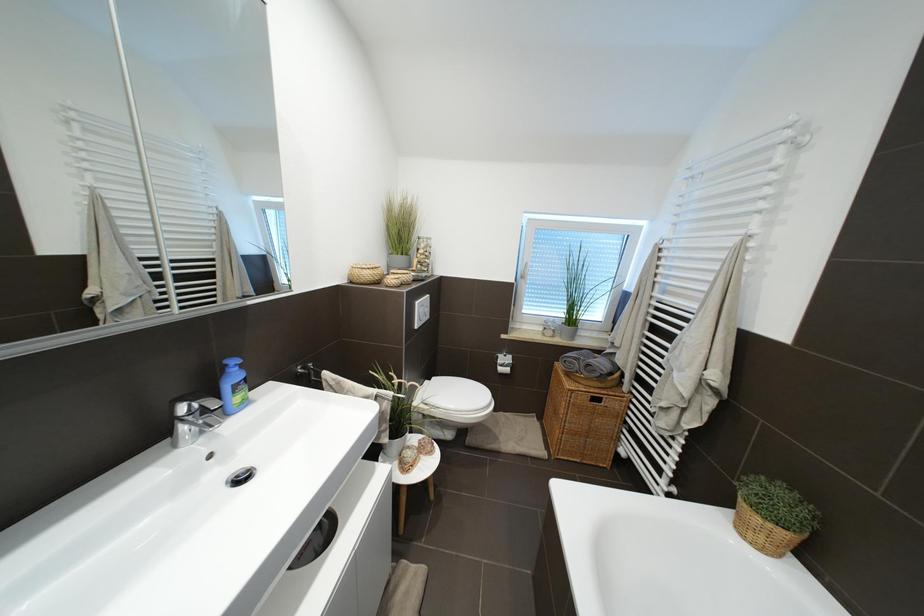
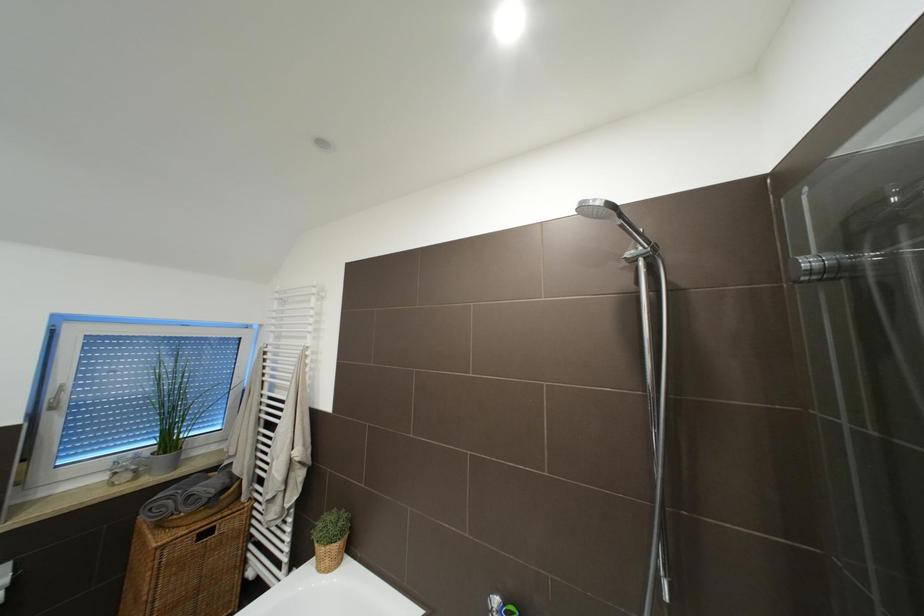
Question: The first image is from the beginning of the video and the second image is from the end. How did the camera likely rotate when shooting the video?

Choices:
 (A) Left
 (B) Right
 (C) Up
 (D) Down

Answer: (B)